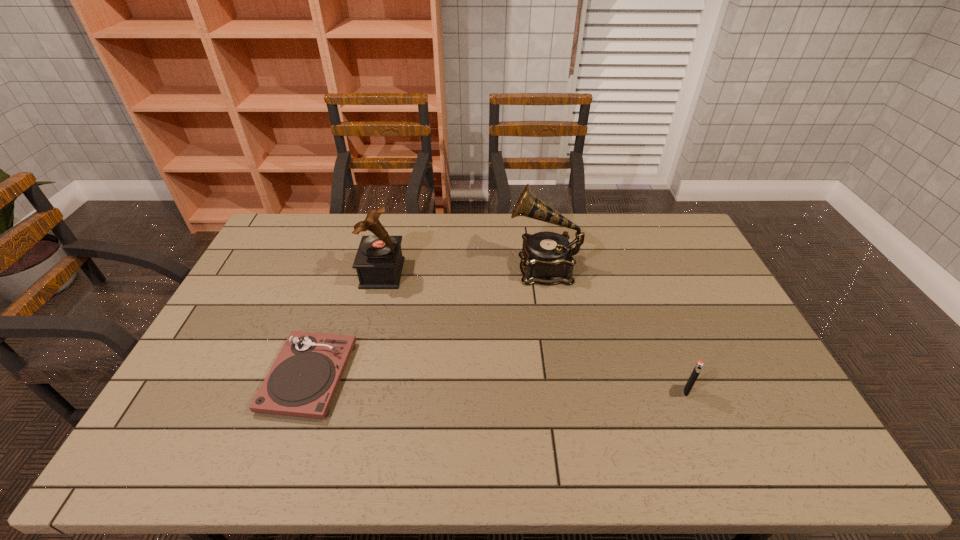
What are the coordinates of `object present at the far edge` in the screenshot? It's located at (546, 258).

The width and height of the screenshot is (960, 540). In the image, there is a desktop. What are the coordinates of `vacant space at the far edge` in the screenshot? It's located at (444, 231).

I want to click on free space at the near edge, so click(x=428, y=453).

This screenshot has height=540, width=960. In order to click on free spot at the left edge of the desktop in this screenshot , I will do `click(213, 344)`.

At what (x,y) coordinates should I click in order to perform the action: click on vacant space at the right edge. Please return your answer as a coordinate pair (x, y). The image size is (960, 540). Looking at the image, I should click on (714, 302).

What are the coordinates of `unoccupied position between the second shortest object and the shortest phonograph_record` in the screenshot? It's located at coord(497,383).

Where is `empty space that is in between the shortest object and the igniter`? The width and height of the screenshot is (960, 540). empty space that is in between the shortest object and the igniter is located at coordinates (497, 383).

Find the location of `vacant space that is in between the igniter and the third object from left to right`. vacant space that is in between the igniter and the third object from left to right is located at coordinates (615, 329).

Where is `empty space between the third object from left to right and the nearest phonograph_record`? empty space between the third object from left to right and the nearest phonograph_record is located at coordinates (426, 321).

This screenshot has width=960, height=540. I want to click on unoccupied area between the second object from right to left and the shortest phonograph_record, so click(426, 321).